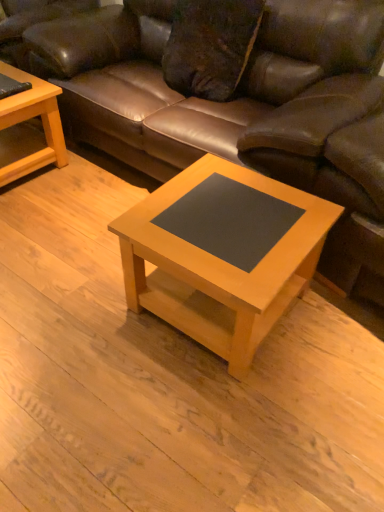
Question: Do you think light wood/finely finished coffee table at left, which is the first coffee table in left-to-right order, is within brown leather couch at center, or outside of it?

Choices:
 (A) outside
 (B) inside

Answer: (A)

Question: From the image's perspective, is light wood/finely finished coffee table at left, which appears as the second coffee table when ordered from the bottom, located above or below brown leather couch at center?

Choices:
 (A) above
 (B) below

Answer: (B)

Question: Which is nearer to the brown leather couch at center?

Choices:
 (A) light wood/black laminate coffee table at center, which is counted as the second coffee table, starting from the back
 (B) light wood/finely finished coffee table at left, the first coffee table viewed from the top

Answer: (A)

Question: Which is nearer to the light wood/black laminate coffee table at center, which is counted as the second coffee table, starting from the back?

Choices:
 (A) brown leather couch at center
 (B) light wood/finely finished coffee table at left, the 1th coffee table in the back-to-front sequence

Answer: (A)